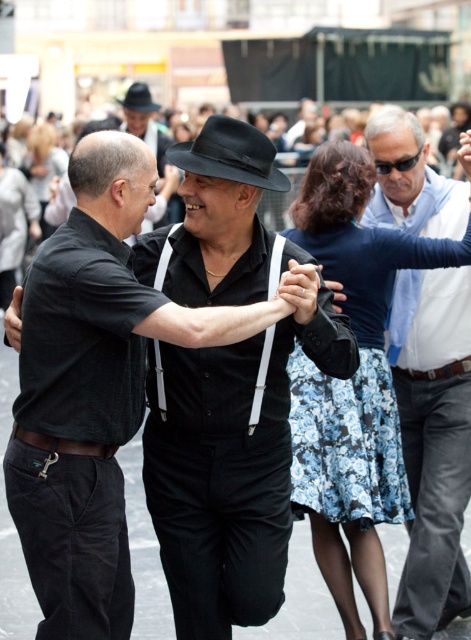
Question: Which point appears farthest from the camera in this image?

Choices:
 (A) (424, 372)
 (B) (135, 109)
 (C) (297, 301)

Answer: (B)

Question: Does black matte suspenders at center come in front of black felt fedora at center?

Choices:
 (A) yes
 (B) no

Answer: (A)

Question: Does black felt fedora at center have a larger size compared to black leather belt at lower left?

Choices:
 (A) no
 (B) yes

Answer: (B)

Question: Which point appears closest to the camera in this image?

Choices:
 (A) (136, 108)
 (B) (454, 532)
 (C) (72, 452)
 (D) (447, 365)

Answer: (C)

Question: Is black felt fedora at center further to the viewer compared to black felt fedora at upper center?

Choices:
 (A) no
 (B) yes

Answer: (A)

Question: Which is nearer to the black leather belt at lower right?

Choices:
 (A) black matte suspenders at center
 (B) light blue shirt at right
 (C) black leather belt at lower left
 (D) black felt fedora at center

Answer: (B)